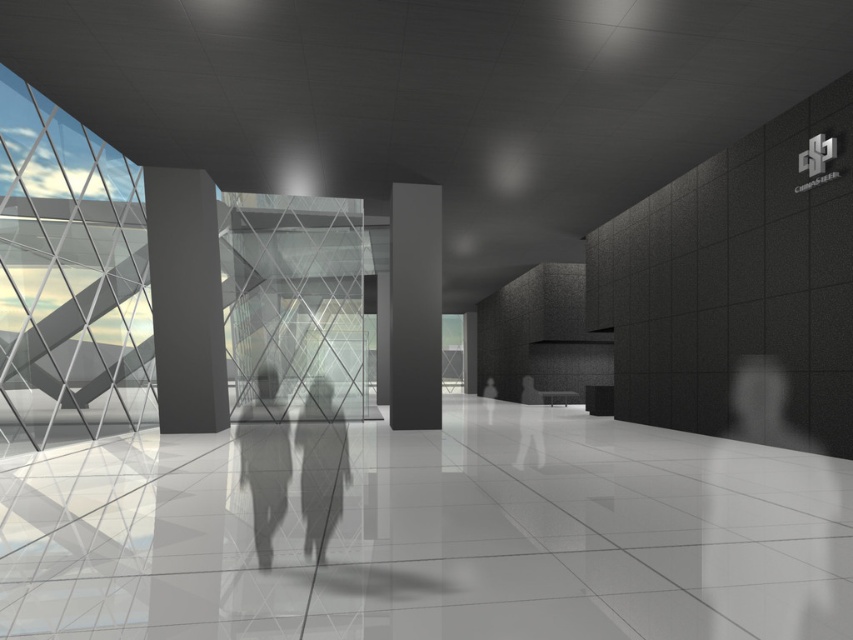
Question: Which point appears farthest from the camera in this image?

Choices:
 (A) (428, 358)
 (B) (277, 390)

Answer: (B)

Question: Which point is closer to the camera?

Choices:
 (A) silhouette figure at center
 (B) matte gray column at center

Answer: (A)

Question: Which of these objects is positioned closest to the matte black pillar at center?

Choices:
 (A) smooth gray figure at center
 (B) matte gray column at center

Answer: (A)

Question: Is matte gray column at center positioned before silhouette figure at center?

Choices:
 (A) no
 (B) yes

Answer: (A)

Question: Can you confirm if matte black pillar at center is positioned to the right of silhouette figure at center?

Choices:
 (A) yes
 (B) no

Answer: (A)

Question: Considering the relative positions of matte black pillar at center and silhouette figure at center in the image provided, where is matte black pillar at center located with respect to silhouette figure at center?

Choices:
 (A) left
 (B) right

Answer: (B)